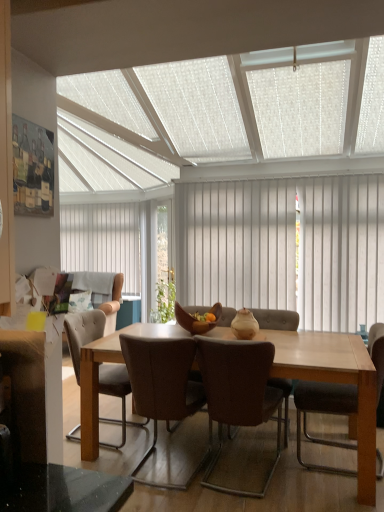
Question: In the image, is leather at center, which is counted as the third chair, starting from the right, positioned in front of or behind white textured ceiling at upper center?

Choices:
 (A) front
 (B) behind

Answer: (B)

Question: From their relative heights in the image, would you say leather at center, which is counted as the third chair, starting from the right, is taller or shorter than white textured ceiling at upper center?

Choices:
 (A) short
 (B) tall

Answer: (A)

Question: Which object is the farthest from the wooden bowl at center?

Choices:
 (A) leather at center, the first chair from the left
 (B) light brown wooden table at center
 (C) brown leather chair at right, the 3th chair viewed from the left
 (D) white vertical blinds at center, the first curtain viewed from the left
 (E) beige fabric couch at left

Answer: (D)

Question: Which of these objects is positioned closest to the brown leather chair at right, the 3th chair viewed from the left?

Choices:
 (A) white textured ceiling at upper center
 (B) wooden bowl at center
 (C) leather at center, which is counted as the third chair, starting from the right
 (D) light brown wooden table at center
 (E) white vertical blinds at center, the first curtain viewed from the left

Answer: (D)